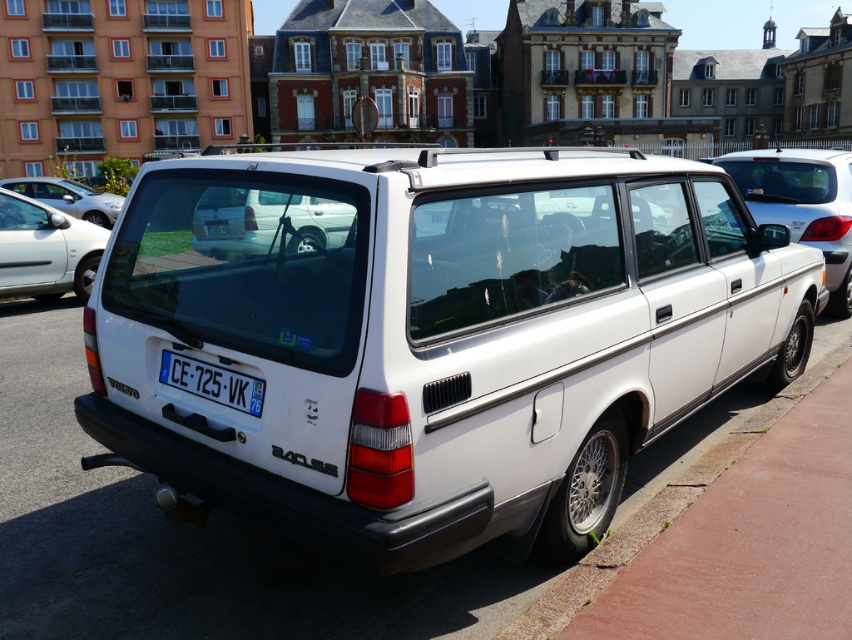
You are a parking attendant who needs to verify the license plate numbers of two vehicles. You see a white plastic license plate at center and a white plastic license plate at rear. Which license plate is located to the left of the other?

The white plastic license plate at center is positioned on the left side of white plastic license plate at rear.

You are a delivery person trying to deliver a package to a white matte hatchback at upper left parked on the street. You are standing in front of the white plastic license plate at rear. Can you reach the hatchback without moving the car?

The white matte hatchback at upper left is further to the viewer than the white plastic license plate at rear, so you cannot reach the hatchback without moving the car since it is positioned in front of the license plate.

You are a delivery person trying to park your van next to the white Volvo 240 GLS. The parking spot is narrow, and you need to know if the white matte hatchback at upper left can fit alongside the white plastic license plate at rear without overlapping. Can you determine if there is enough space?

The white matte hatchback at upper left might be wider than white plastic license plate at rear, so there may not be enough space for them to fit side by side without overlapping.